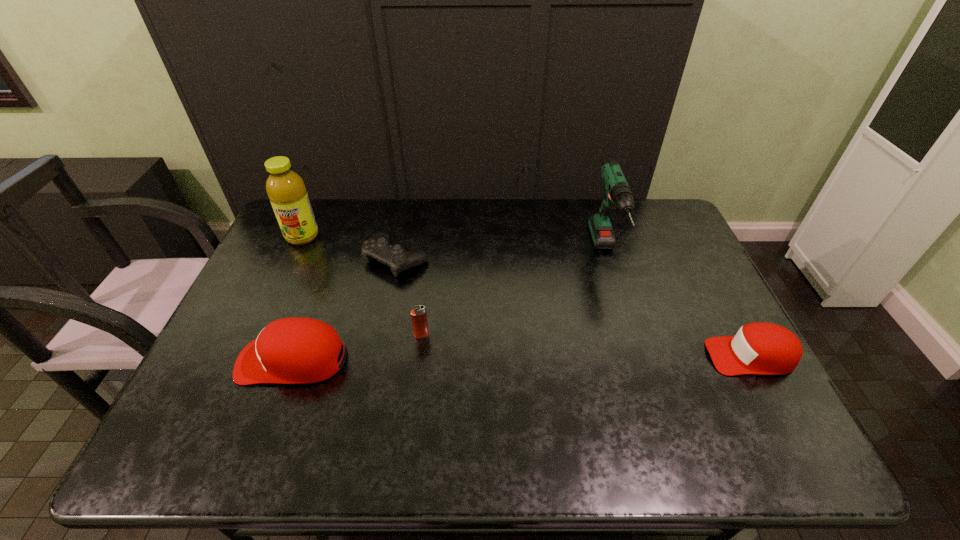
Find the location of a particular element. This screenshot has height=540, width=960. object situated at the right edge is located at coordinates (761, 348).

In order to click on object that is at the far left corner in this screenshot , I will do `click(286, 190)`.

Image resolution: width=960 pixels, height=540 pixels. Identify the location of object located at the near left corner. (297, 350).

Locate an element on the screen. The width and height of the screenshot is (960, 540). vacant space at the far edge of the desktop is located at coordinates (x=456, y=214).

In the image, there is a desktop. What are the coordinates of `vacant space at the right edge` in the screenshot? It's located at (717, 332).

Image resolution: width=960 pixels, height=540 pixels. Find the location of `vacant space at the far left corner of the desktop`. vacant space at the far left corner of the desktop is located at coordinates (335, 203).

This screenshot has width=960, height=540. In the image, there is a desktop. What are the coordinates of `vacant space at the far right corner` in the screenshot? It's located at pos(636,207).

Where is `free space between the control and the fruit juice`? The width and height of the screenshot is (960, 540). free space between the control and the fruit juice is located at coordinates (349, 247).

Find the location of a particular element. This screenshot has width=960, height=540. vacant space that is in between the drill and the control is located at coordinates (501, 256).

In order to click on vacant point located between the fifth object from left to right and the control in this screenshot , I will do `click(501, 256)`.